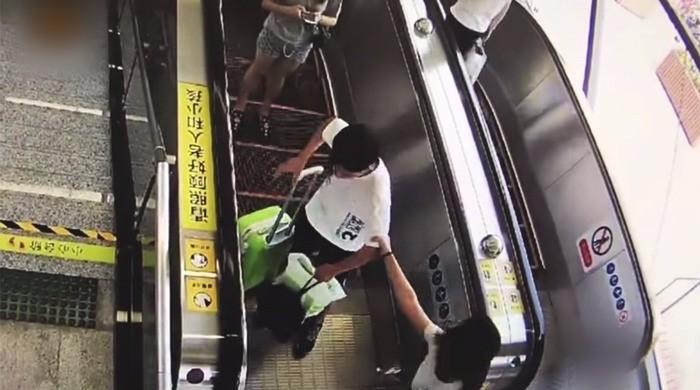
Identify the location of handrail. point(113,247), point(157,246), point(232,261), point(461,265), point(512,273).